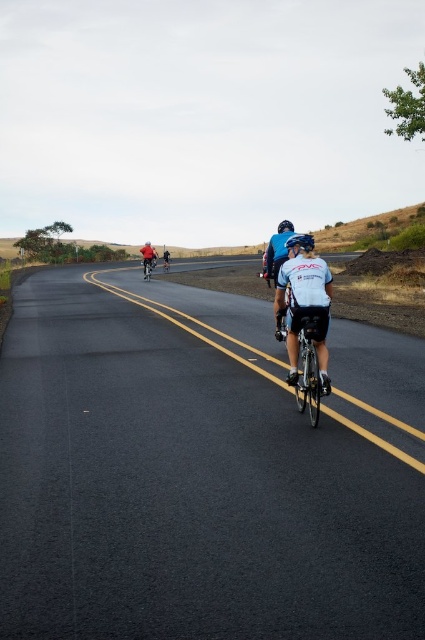
Question: Which point is closer to the camera?

Choices:
 (A) shiny red bicycle at center
 (B) white matte bicycle helmet at center
 (C) shiny silver bicycle at center
 (D) matte blue helmet at center

Answer: (C)

Question: Can you confirm if matte blue helmet at center is thinner than shiny metallic bicycle at center?

Choices:
 (A) no
 (B) yes

Answer: (B)

Question: Is shiny silver bicycle at center positioned in front of shiny red bicycle at center?

Choices:
 (A) yes
 (B) no

Answer: (A)

Question: Is matte red bicycle at center to the left of shiny metallic bicycle at center from the viewer's perspective?

Choices:
 (A) no
 (B) yes

Answer: (A)

Question: Which is farther from the matte red bicycle at center?

Choices:
 (A) white matte bicycle helmet at center
 (B) white matte jersey at center
 (C) shiny red bicycle at center

Answer: (B)

Question: Which point appears farthest from the camera in this image?

Choices:
 (A) (155, 266)
 (B) (289, 221)
 (C) (305, 298)
 (D) (288, 248)

Answer: (A)